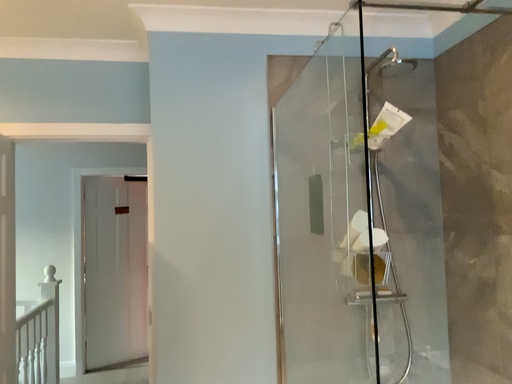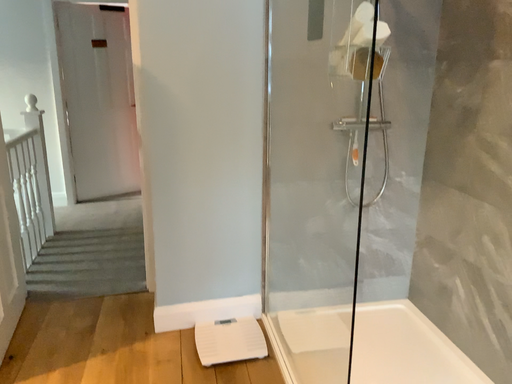
Question: How did the camera likely rotate when shooting the video?

Choices:
 (A) rotated downward
 (B) rotated upward

Answer: (A)